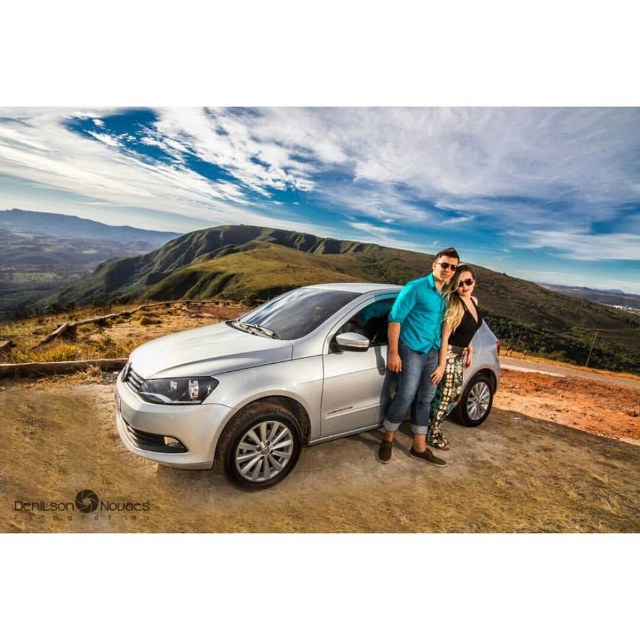
Question: Is satin silver car at center above teal fabric shirt at center?

Choices:
 (A) no
 (B) yes

Answer: (A)

Question: Is satin silver car at center thinner than printed fabric pants at center?

Choices:
 (A) no
 (B) yes

Answer: (A)

Question: Which point is farther from the camera taking this photo?

Choices:
 (A) (428, 355)
 (B) (451, 369)

Answer: (B)

Question: Which point is farther to the camera?

Choices:
 (A) printed fabric pants at center
 (B) satin silver car at center

Answer: (A)

Question: Does teal fabric shirt at center have a smaller size compared to printed fabric pants at center?

Choices:
 (A) no
 (B) yes

Answer: (A)

Question: Which point is closer to the camera?

Choices:
 (A) (397, 413)
 (B) (477, 323)
 (C) (244, 470)

Answer: (C)